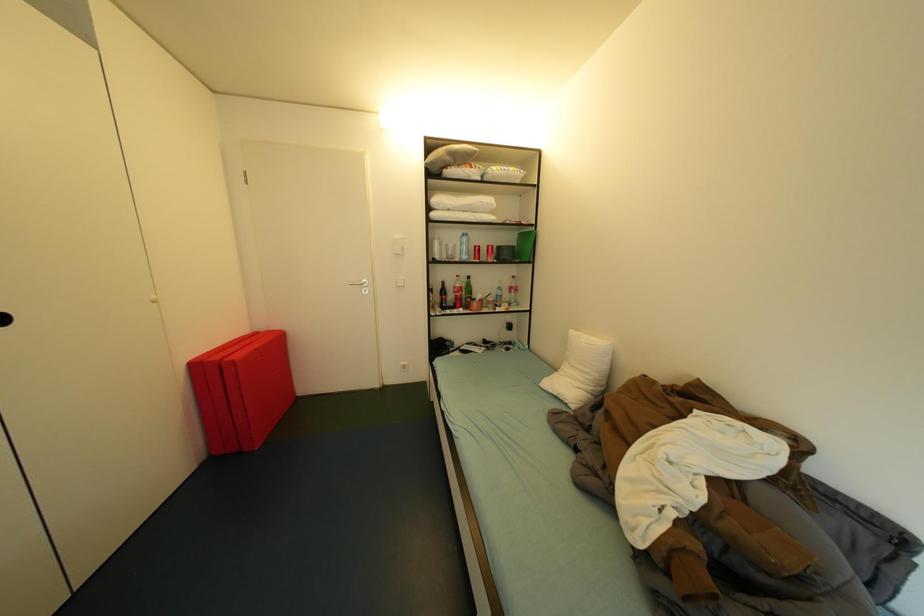
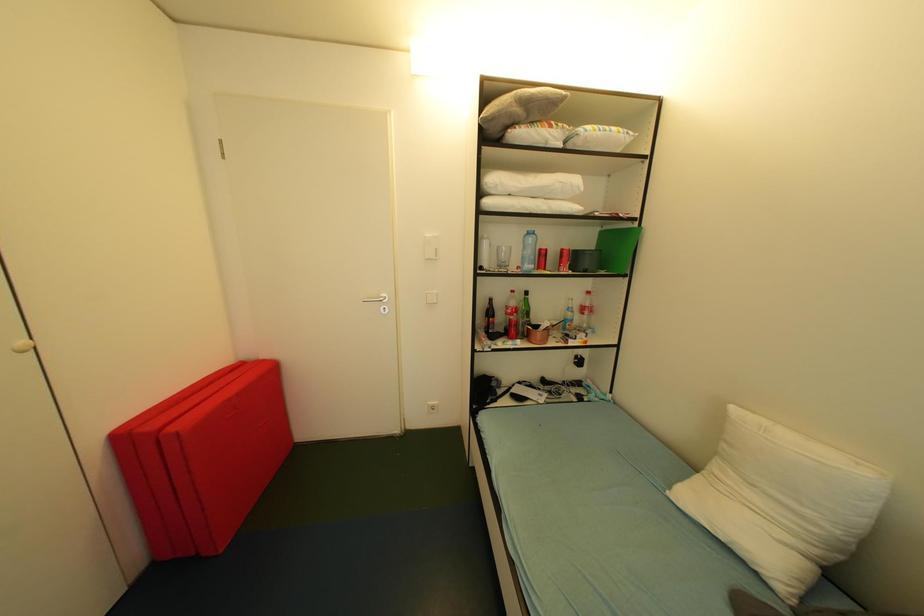
Looking at this image, in a continuous first-person perspective shot, in which direction is the camera moving?

The movement direction of the cameraman is left, forward.